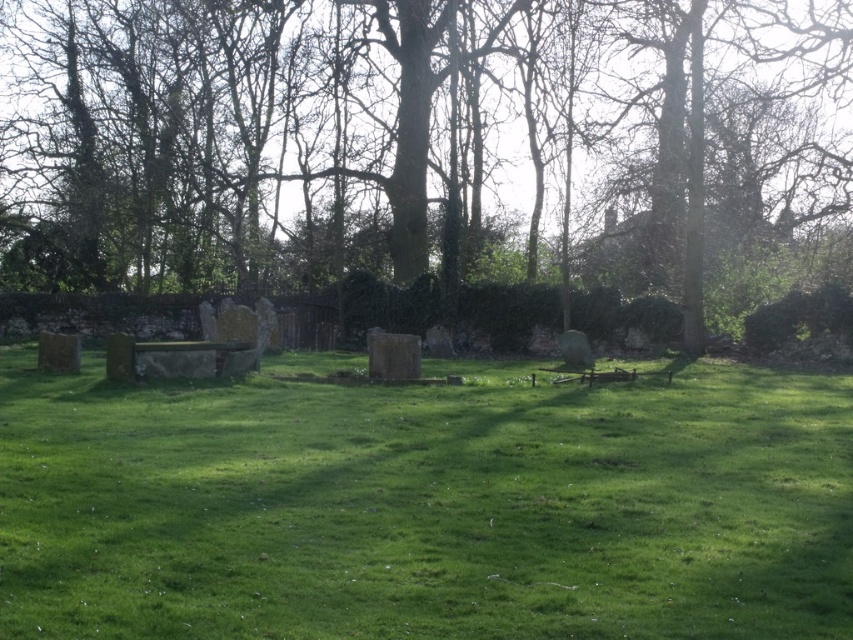
Question: Which point appears closest to the camera in this image?

Choices:
 (A) (260, 196)
 (B) (245, 614)

Answer: (B)

Question: Is green leafy tree at center positioned before green grassy field at center?

Choices:
 (A) yes
 (B) no

Answer: (B)

Question: Which point is farther to the camera?

Choices:
 (A) (553, 419)
 (B) (520, 45)

Answer: (B)

Question: Which point appears farthest from the camera in this image?

Choices:
 (A) (100, 99)
 (B) (639, 557)

Answer: (A)

Question: Is green leafy tree at center thinner than green grassy field at center?

Choices:
 (A) no
 (B) yes

Answer: (A)

Question: Where is green leafy tree at center located in relation to green grassy field at center in the image?

Choices:
 (A) below
 (B) above

Answer: (B)